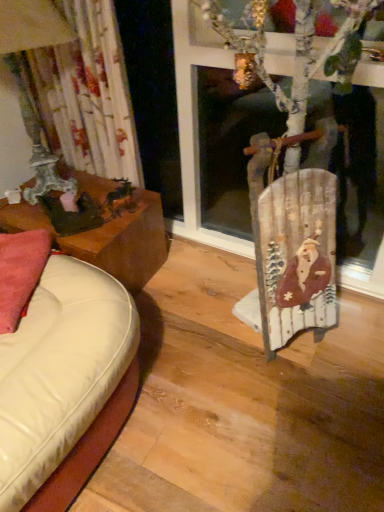
You are a GUI agent. You are given a task and a screenshot of the screen. Output one action in this format:
    pyautogui.click(x=<x>, y=<y>)
    Task: Click on the free region on the left part of wooden sled at right
    The height and width of the screenshot is (512, 384).
    Given the screenshot: What is the action you would take?
    pyautogui.click(x=218, y=343)